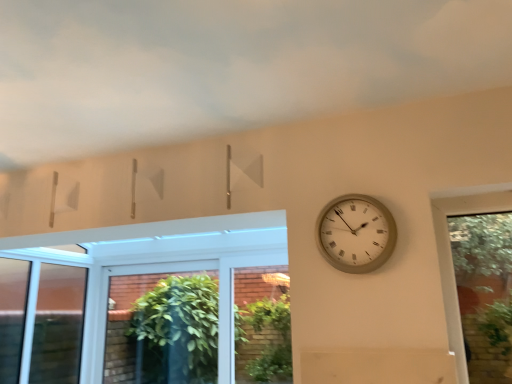
Question: Is beige textured clock at right facing towards cloudy sky at upper center?

Choices:
 (A) yes
 (B) no

Answer: (B)

Question: Can you confirm if beige textured clock at right is shorter than cloudy sky at upper center?

Choices:
 (A) yes
 (B) no

Answer: (B)

Question: Considering the relative sizes of beige textured clock at right and cloudy sky at upper center in the image provided, is beige textured clock at right thinner than cloudy sky at upper center?

Choices:
 (A) yes
 (B) no

Answer: (A)

Question: Does beige textured clock at right appear on the right side of cloudy sky at upper center?

Choices:
 (A) no
 (B) yes

Answer: (B)

Question: Does beige textured clock at right have a larger size compared to cloudy sky at upper center?

Choices:
 (A) no
 (B) yes

Answer: (A)

Question: From a real-world perspective, is green leafy plant at lower center positioned above or below cloudy sky at upper center?

Choices:
 (A) below
 (B) above

Answer: (A)

Question: Is point (256, 340) positioned closer to the camera than point (283, 114)?

Choices:
 (A) closer
 (B) farther

Answer: (B)

Question: Considering the positions of green leafy plant at lower center and cloudy sky at upper center in the image, is green leafy plant at lower center taller or shorter than cloudy sky at upper center?

Choices:
 (A) tall
 (B) short

Answer: (A)

Question: Which is correct: green leafy plant at lower center is inside cloudy sky at upper center, or outside of it?

Choices:
 (A) inside
 (B) outside

Answer: (B)

Question: Would you say green leafy plant at lower center is to the left or to the right of beige textured clock at right in the picture?

Choices:
 (A) right
 (B) left

Answer: (B)

Question: Would you say green leafy plant at lower center is inside or outside beige textured clock at right?

Choices:
 (A) inside
 (B) outside

Answer: (B)

Question: Is green leafy plant at lower center taller or shorter than beige textured clock at right?

Choices:
 (A) tall
 (B) short

Answer: (A)

Question: From the image's perspective, is green leafy plant at lower center positioned above or below beige textured clock at right?

Choices:
 (A) below
 (B) above

Answer: (A)

Question: Is cloudy sky at upper center spatially inside beige textured clock at right, or outside of it?

Choices:
 (A) inside
 (B) outside

Answer: (B)

Question: Considering the positions of cloudy sky at upper center and beige textured clock at right in the image, is cloudy sky at upper center taller or shorter than beige textured clock at right?

Choices:
 (A) tall
 (B) short

Answer: (B)